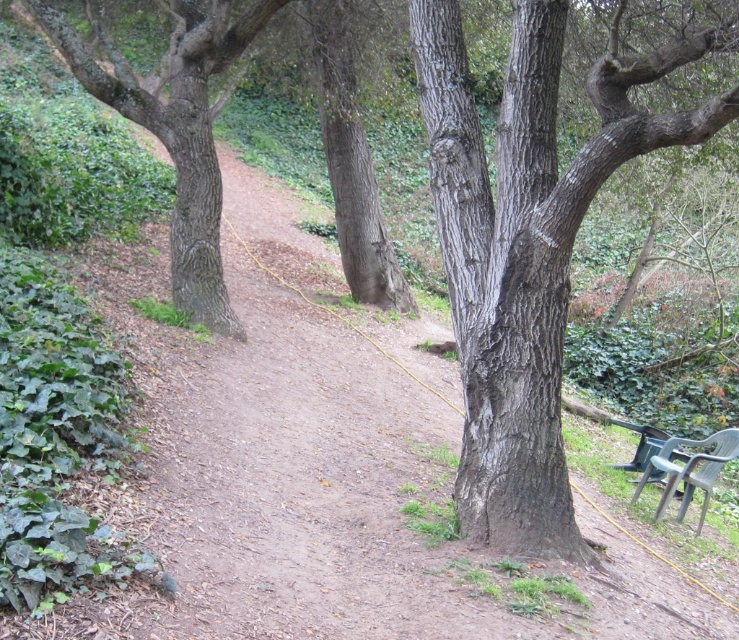
Question: Which of the following is the farthest from the observer?

Choices:
 (A) smooth bark tree at center
 (B) smooth gray bark tree at center

Answer: (A)

Question: Which object is closer to the camera taking this photo?

Choices:
 (A) smooth bark tree at center
 (B) green plastic chair at lower right

Answer: (B)

Question: Can you confirm if smooth gray bark tree at center is wider than green plastic chair at lower right?

Choices:
 (A) yes
 (B) no

Answer: (A)

Question: Is smooth bark tree at center thinner than green plastic chair at lower right?

Choices:
 (A) no
 (B) yes

Answer: (A)

Question: Can you confirm if smooth bark tree at center is bigger than green plastic chair at lower right?

Choices:
 (A) no
 (B) yes

Answer: (B)

Question: Which object is farther from the camera taking this photo?

Choices:
 (A) green plastic chair at lower right
 (B) smooth gray bark tree at center

Answer: (A)